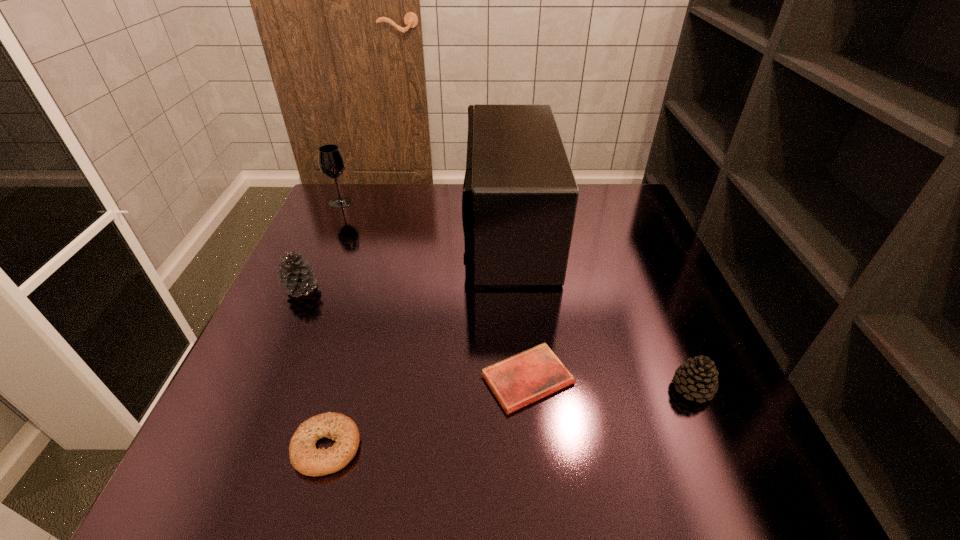
Locate an element on the screen. Image resolution: width=960 pixels, height=540 pixels. vacant space located 0.180m on the front-facing side of the tallest object is located at coordinates (398, 230).

You are a GUI agent. You are given a task and a screenshot of the screen. Output one action in this format:
    pyautogui.click(x=<x>, y=<y>)
    Task: Click on the free space located 0.110m on the front-facing side of the tallest object
    The height and width of the screenshot is (540, 960).
    Given the screenshot: What is the action you would take?
    pyautogui.click(x=424, y=230)

Identify the location of vacant space situated 0.170m on the right of the wineglass. (411, 202).

Locate an element on the screen. The height and width of the screenshot is (540, 960). free space located on the front of the farther pinecone is located at coordinates (252, 397).

The width and height of the screenshot is (960, 540). In order to click on vacant position located 0.080m at the narrow end of the shorter pinecone in this screenshot , I will do `click(718, 448)`.

You are a GUI agent. You are given a task and a screenshot of the screen. Output one action in this format:
    pyautogui.click(x=<x>, y=<y>)
    Task: Click on the vacant space situated 0.090m on the right of the third object from left to right
    The width and height of the screenshot is (960, 540).
    Given the screenshot: What is the action you would take?
    coord(415,448)

Image resolution: width=960 pixels, height=540 pixels. Identify the location of free location located on the right of the diary. (708, 379).

This screenshot has width=960, height=540. What are the coordinates of `microwave_oven situated at the far edge` in the screenshot? It's located at (519, 200).

Find the location of a particular element. wineglass located at the far edge is located at coordinates (331, 162).

Locate an element on the screen. object that is at the near edge is located at coordinates (304, 456).